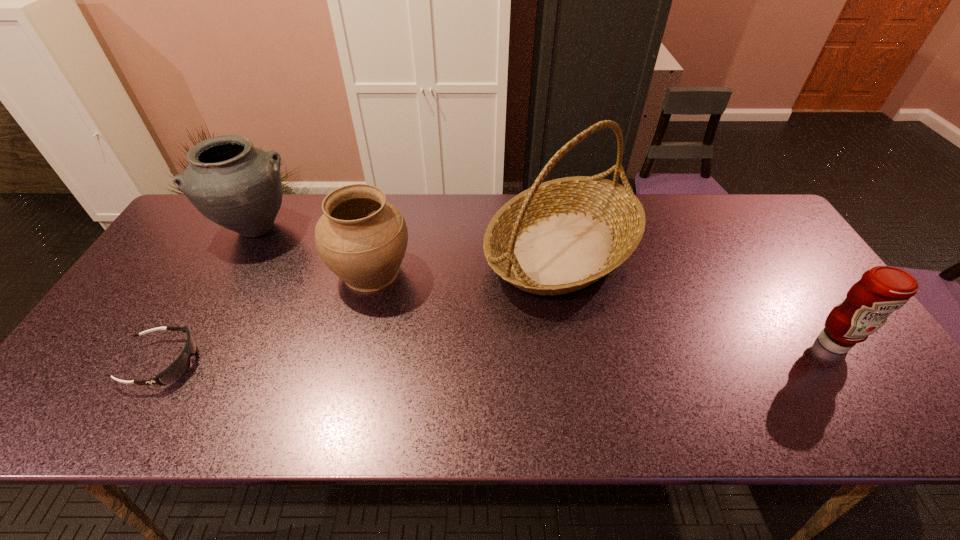
Locate an element on the screen. This screenshot has height=540, width=960. vacant space at the right edge of the desktop is located at coordinates (804, 287).

Image resolution: width=960 pixels, height=540 pixels. Find the location of `vacant area between the third object from right to left and the goggles`. vacant area between the third object from right to left and the goggles is located at coordinates (267, 317).

You are a GUI agent. You are given a task and a screenshot of the screen. Output one action in this format:
    pyautogui.click(x=<x>, y=<y>)
    Task: Click on the unoccupied position between the left urn and the right urn
    
    Given the screenshot: What is the action you would take?
    pyautogui.click(x=313, y=249)

Find the location of `unoccupied position between the condiment and the tallest object`. unoccupied position between the condiment and the tallest object is located at coordinates (698, 296).

Identify the location of free area in between the left urn and the third object from left to right. This screenshot has height=540, width=960. (313, 249).

At what (x,y) coordinates should I click in order to perform the action: click on vacant area that lies between the goggles and the third object from right to left. Please return your answer as a coordinate pair (x, y). Looking at the image, I should click on (267, 317).

The image size is (960, 540). I want to click on free point between the second object from right to left and the rightmost object, so tap(698, 296).

Locate an element on the screen. The image size is (960, 540). unoccupied area between the third object from right to left and the left urn is located at coordinates (313, 249).

This screenshot has width=960, height=540. Find the location of `free area in between the right urn and the condiment`. free area in between the right urn and the condiment is located at coordinates (602, 307).

This screenshot has height=540, width=960. I want to click on vacant area that lies between the goggles and the left urn, so click(209, 295).